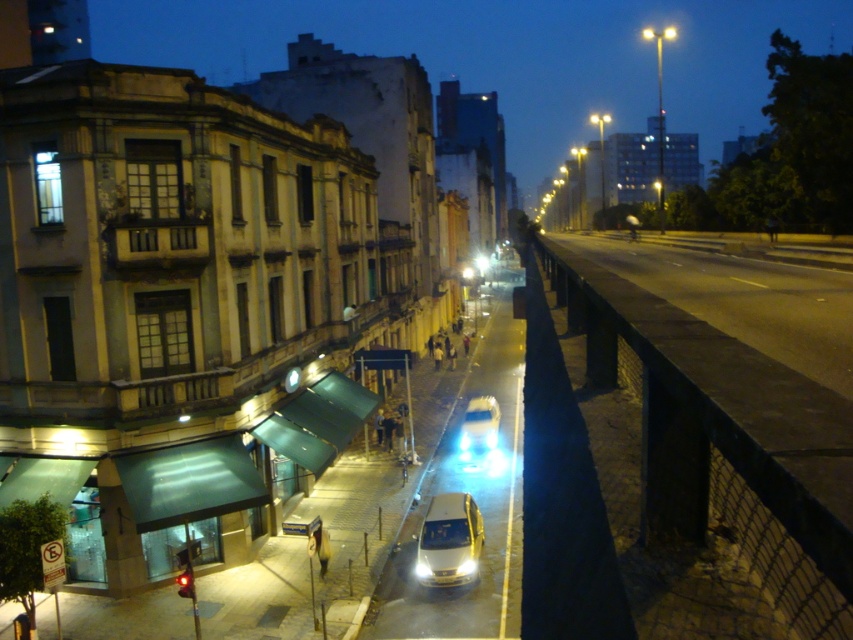
Between yellow matte car at center and shiny silver car at center, which one has less height?

yellow matte car at center is shorter.

Between yellow matte car at center and shiny silver car at center, which one has more height?

shiny silver car at center is taller.

Find the location of a particular element. This screenshot has height=640, width=853. yellow matte car at center is located at coordinates (450, 541).